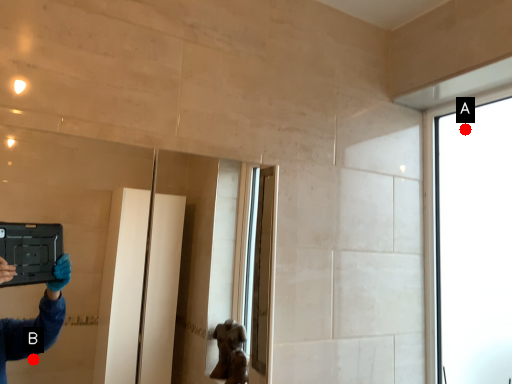
Question: Two points are circled on the image, labeled by A and B beside each circle. Which of the following is the closest to the observer?

Choices:
 (A) A is closer
 (B) B is closer

Answer: (A)